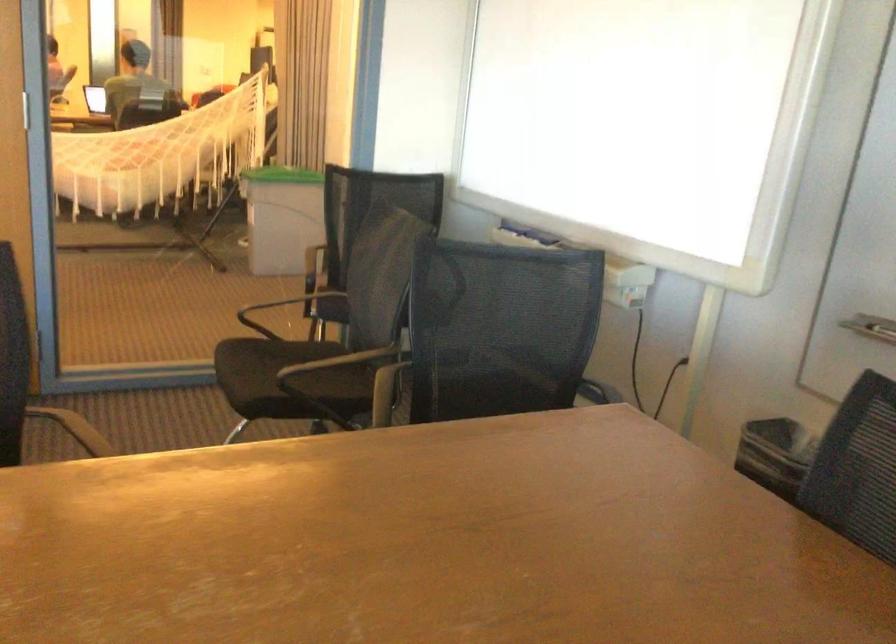
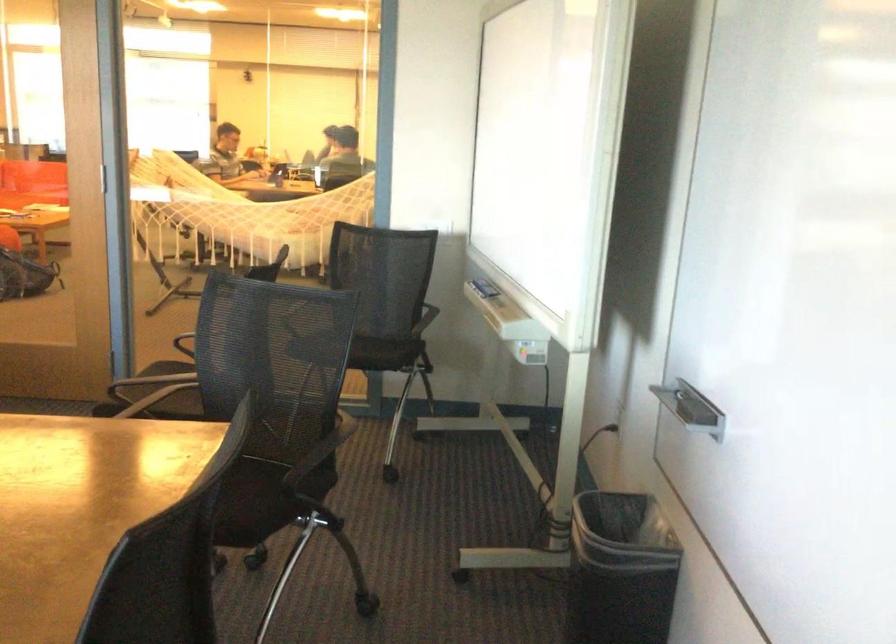
In the second image, find the point that corresponds to [530,229] in the first image.

(484, 288)